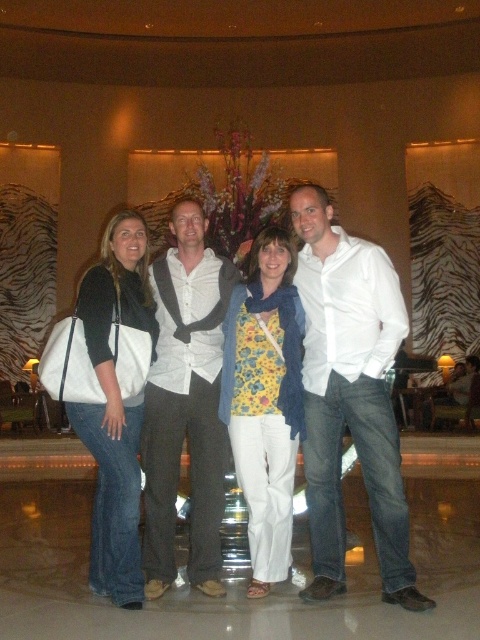
You are standing at the point with coordinates point (186, 404) in the image. What object is located at this point?

The point (186, 404) corresponds to the white matte shirt at center.